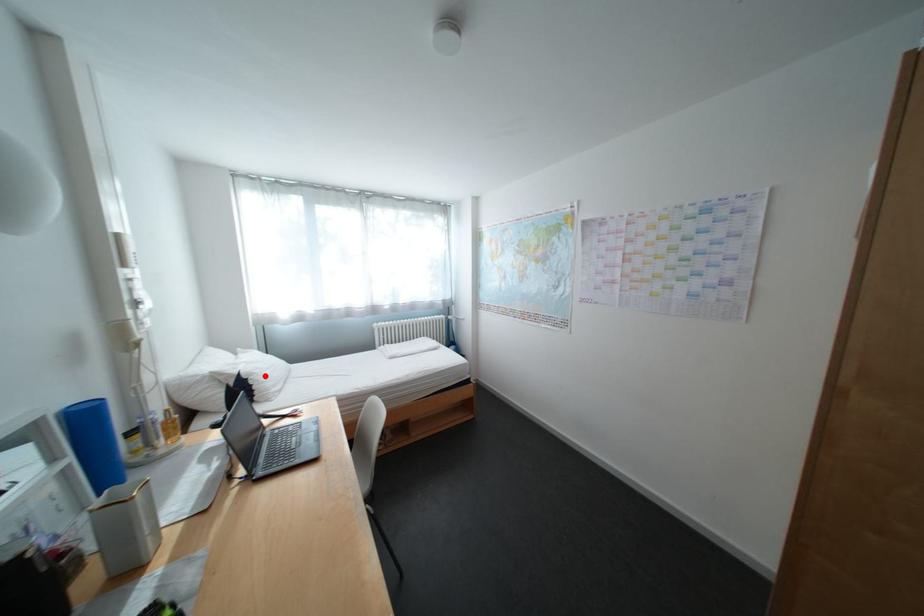
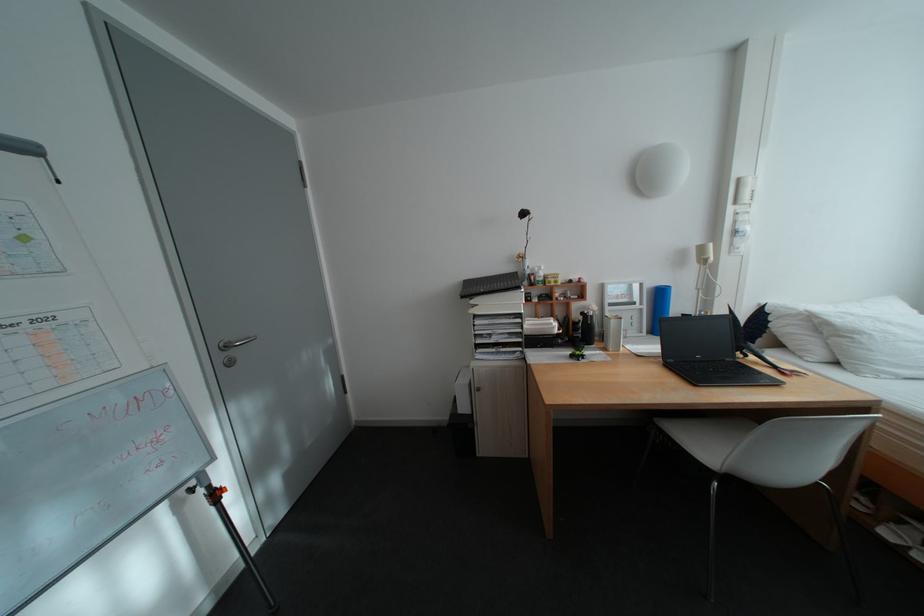
Question: I am providing you with two images of the same scene from different viewpoints. Image1 has a red point marked. In image2, the corresponding 3D location appears at what relative position? Reply with the corresponding letter.

Choices:
 (A) Closer
 (B) Farther

Answer: (B)